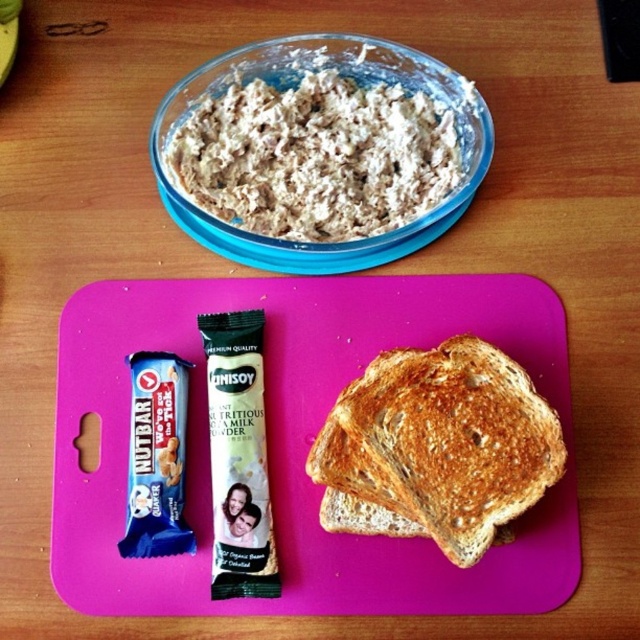
Question: Which point is farther from the camera taking this photo?

Choices:
 (A) (88, 410)
 (B) (456, 512)

Answer: (A)

Question: Is the position of golden brown toasted bread at center less distant than that of translucent glass bowl at upper center?

Choices:
 (A) yes
 (B) no

Answer: (A)

Question: Which of the following is the farthest from the observer?

Choices:
 (A) yellow matte banana at upper left
 (B) translucent glass bowl at upper center
 (C) pink plastic cutting board at center

Answer: (A)

Question: Does golden brown toasted bread at center appear under yellow matte banana at upper left?

Choices:
 (A) yes
 (B) no

Answer: (A)

Question: Is translucent glass bowl at upper center smaller than yellow matte banana at upper left?

Choices:
 (A) yes
 (B) no

Answer: (B)

Question: Among these points, which one is nearest to the camera?

Choices:
 (A) (355, 480)
 (B) (68, 444)
 (C) (360, 243)

Answer: (A)